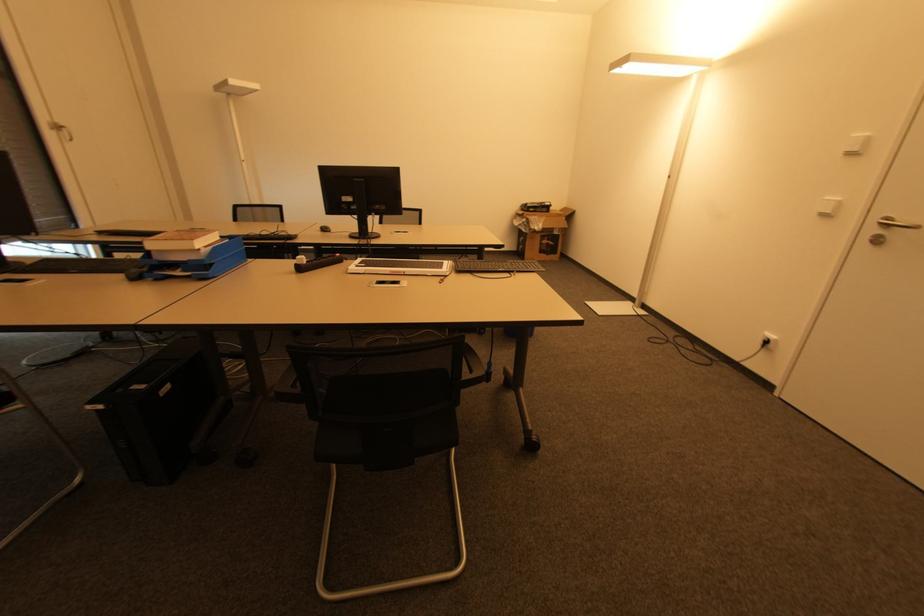
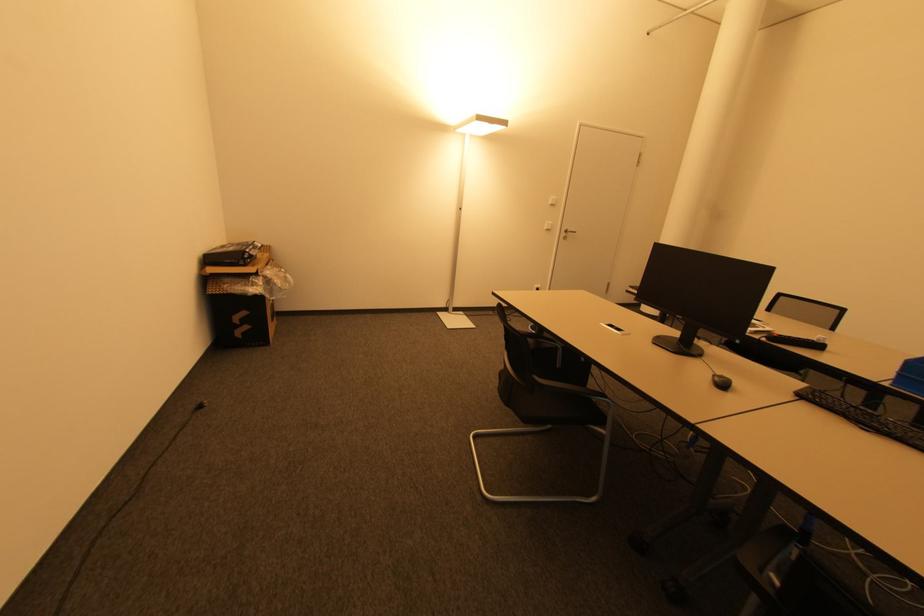
The point at (533, 209) is marked in the first image. Where is the corresponding point in the second image?

(250, 261)